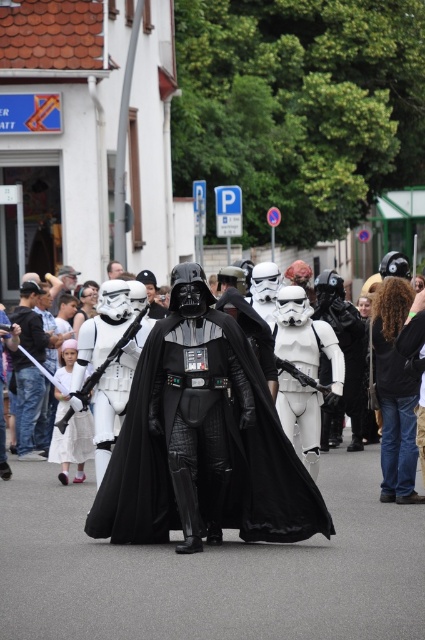
You are a photographer trying to capture a group photo of the Darth Vader and the Stormtroopers. You notice two black helmets in the scene. How far apart are the matte black helmet at center and the black matte helmet at center?

The matte black helmet at center and the black matte helmet at center are 4.88 meters apart.

You are a photographer standing 10 meters away from the shiny black cape at center and the matte black helmet at center. You want to take a photo that includes both objects in the frame. Given that your camera has a maximum zoom range of 10 meters, will you be able to capture both objects in the same photo without moving closer?

The shiny black cape at center and the matte black helmet at center are 5.91 meters apart. Since your camera can zoom up to 10 meters, which is greater than the distance between the objects, you can capture both in the same photo without moving closer.

You are a photographer trying to capture the Darth Vader costume from the scene. You notice the shiny black cape at center and the black matte helmet at center. Which object should you focus on first if you want to ensure both are in frame without moving the camera?

The shiny black cape at center is below the black matte helmet at center, so focusing on the black matte helmet at center first will allow you to frame both objects since it is positioned higher up.